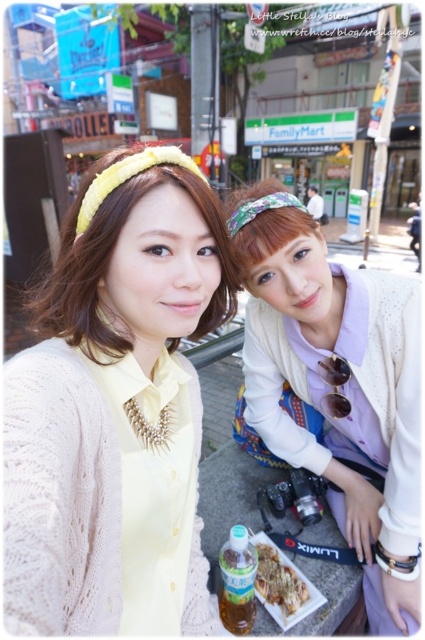
You are standing at the point labeled as point (288, 586) in the image. You want to walk towards the point labeled as point (312, 356). Will you have to go forward or backward?

Since point (312, 356) is behind point (288, 586), you will have to go backward to reach it.

Based on the photo, you are standing in the scene and want to move from the point at coordinates point [68,241] to the point at coordinates point [300,589]. Which direction should you face to walk towards the second point?

Since point [68,241] is closer to the viewer than point [300,589], you should face away from the viewer to walk towards the second point.

Looking at this image, you are a photographer trying to capture the matte yellow headband at upper center and the matte yellow cardigan at center in the same frame. Which object should you focus on first to ensure both are in the frame without moving the camera?

The matte yellow headband at upper center is above the matte yellow cardigan at center, so focus on the matte yellow headband at upper center first to ensure both are in the frame without moving the camera.